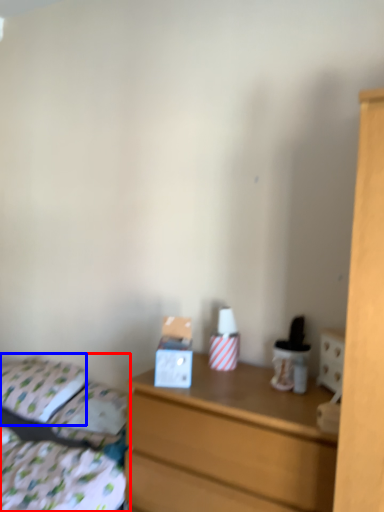
Question: Which object is closer to the camera taking this photo, bed (highlighted by a red box) or pillow (highlighted by a blue box)?

Choices:
 (A) bed
 (B) pillow

Answer: (A)